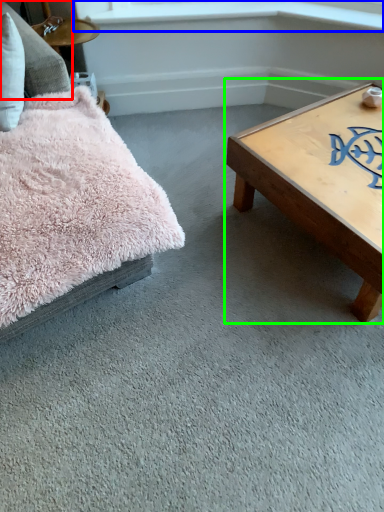
Question: Based on their relative distances, which object is farther from pillow (highlighted by a red box)? Choose from window sill (highlighted by a blue box) and coffee table (highlighted by a green box).

Choices:
 (A) window sill
 (B) coffee table

Answer: (B)